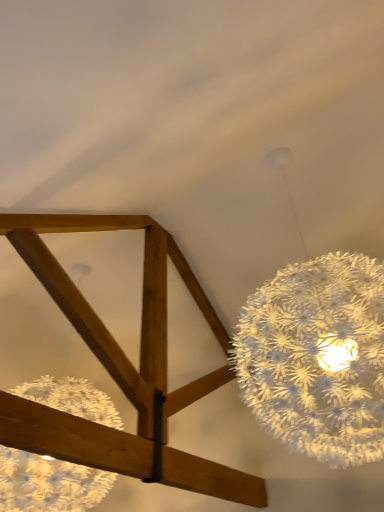
Describe the element at coordinates (317, 357) in the screenshot. I see `white paper-like at upper right` at that location.

The height and width of the screenshot is (512, 384). I want to click on white paper-like at upper right, so click(317, 357).

I want to click on white paper-like at upper right, so click(x=317, y=357).